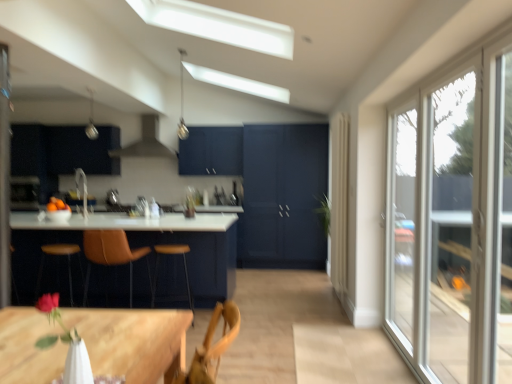
Question: Is matte dark blue cabinet at center outside of silver metallic light fixture at upper center, the 2th light fixture from the right?

Choices:
 (A) yes
 (B) no

Answer: (A)

Question: Considering the relative sizes of matte dark blue cabinet at center and silver metallic light fixture at upper center, the 2th light fixture from the right, in the image provided, is matte dark blue cabinet at center taller than silver metallic light fixture at upper center, the 2th light fixture from the right,?

Choices:
 (A) no
 (B) yes

Answer: (B)

Question: Considering the relative positions of matte dark blue cabinet at center and silver metallic light fixture at upper center, the 2th light fixture from the right, in the image provided, is matte dark blue cabinet at center behind silver metallic light fixture at upper center, the 2th light fixture from the right,?

Choices:
 (A) no
 (B) yes

Answer: (B)

Question: Can you confirm if matte dark blue cabinet at center is wider than silver metallic light fixture at upper center, which ranks as the 1th light fixture in left-to-right order?

Choices:
 (A) yes
 (B) no

Answer: (A)

Question: Can you confirm if matte dark blue cabinet at center is positioned to the left of silver metallic light fixture at upper center, which ranks as the 1th light fixture in left-to-right order?

Choices:
 (A) yes
 (B) no

Answer: (B)

Question: Is matte dark blue cabinet at center in front of silver metallic light fixture at upper center, which ranks as the 1th light fixture in left-to-right order?

Choices:
 (A) yes
 (B) no

Answer: (B)

Question: Does silver metallic light fixture at upper center, the 2th light fixture from the right, have a larger size compared to matte dark blue cabinet at center?

Choices:
 (A) yes
 (B) no

Answer: (B)

Question: Is silver metallic light fixture at upper center, which ranks as the 1th light fixture in left-to-right order, taller than matte dark blue cabinet at center?

Choices:
 (A) yes
 (B) no

Answer: (B)

Question: Considering the relative sizes of silver metallic light fixture at upper center, which ranks as the 1th light fixture in left-to-right order, and matte dark blue cabinet at center in the image provided, is silver metallic light fixture at upper center, which ranks as the 1th light fixture in left-to-right order, wider than matte dark blue cabinet at center?

Choices:
 (A) yes
 (B) no

Answer: (B)

Question: Are silver metallic light fixture at upper center, the 2th light fixture from the right, and matte dark blue cabinet at center beside each other?

Choices:
 (A) no
 (B) yes

Answer: (A)

Question: Considering the relative sizes of silver metallic light fixture at upper center, which ranks as the 1th light fixture in left-to-right order, and matte dark blue cabinet at center in the image provided, is silver metallic light fixture at upper center, which ranks as the 1th light fixture in left-to-right order, shorter than matte dark blue cabinet at center?

Choices:
 (A) yes
 (B) no

Answer: (A)

Question: Can you confirm if orange matte bowl at left is thinner than brown leather bar stool at left, the second bar stool in the right-to-left sequence?

Choices:
 (A) no
 (B) yes

Answer: (B)